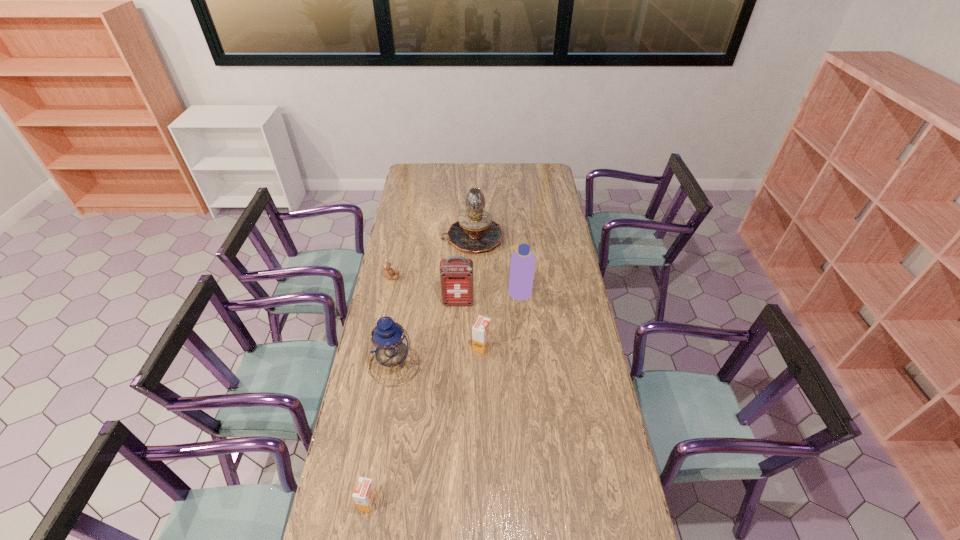
Where is `vacant region located on the front of the taller orange juice`? Image resolution: width=960 pixels, height=540 pixels. vacant region located on the front of the taller orange juice is located at coordinates (482, 452).

Find the location of a particular element. free space located 0.070m on the front-facing side of the first-aid kit is located at coordinates (457, 319).

Locate an element on the screen. free spot located on the front-facing side of the lantern is located at coordinates (379, 455).

Where is `free point located 0.190m on the face of the shortest object`? free point located 0.190m on the face of the shortest object is located at coordinates (439, 277).

I want to click on vacant space located 0.340m on the left of the rightmost object, so click(x=433, y=291).

I want to click on vacant space located on the front of the oil lamp, so click(x=472, y=277).

The height and width of the screenshot is (540, 960). Identify the location of object located in the near edge section of the desktop. (365, 494).

Identify the location of orange juice located in the left edge section of the desktop. Image resolution: width=960 pixels, height=540 pixels. (365, 494).

Locate an element on the screen. lantern situated at the left edge is located at coordinates (389, 344).

Find the location of a particular element. This screenshot has width=960, height=540. teddy bear that is at the left edge is located at coordinates (388, 272).